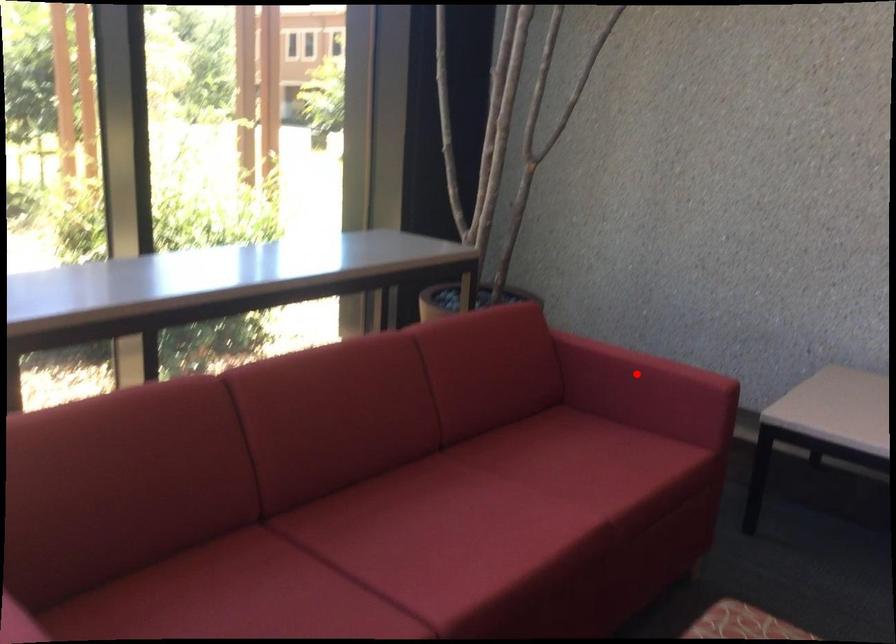
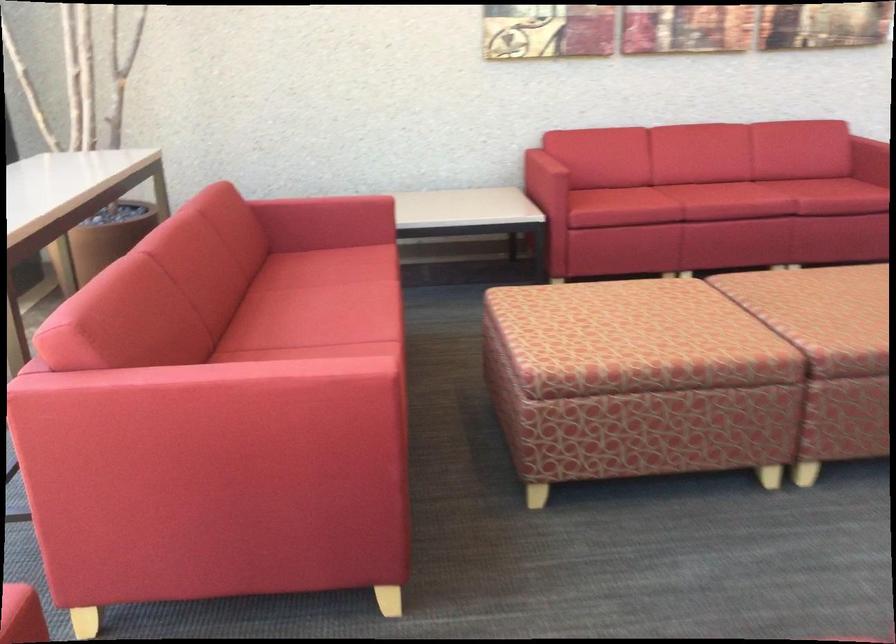
Locate, in the second image, the point that corresponds to the highlighted location in the first image.

(326, 207)